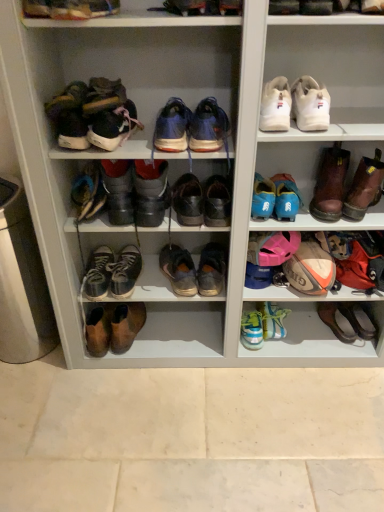
What are the coordinates of `vacant space underneath blue suede sneakers at center, the eighth footwear viewed from the left (from a real-world perspective)` in the screenshot? It's located at pos(211,343).